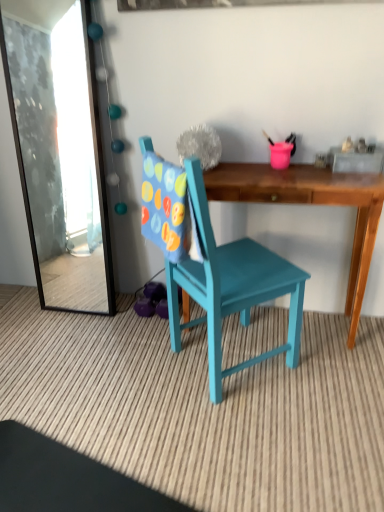
The width and height of the screenshot is (384, 512). What are the coordinates of `free space in front of wooden desk at center` in the screenshot? It's located at (300, 407).